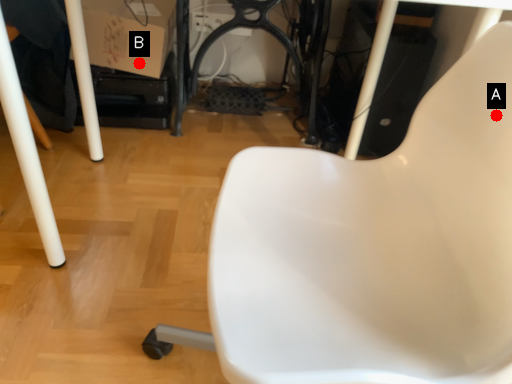
Question: Two points are circled on the image, labeled by A and B beside each circle. Which of the following is the farthest from the observer?

Choices:
 (A) A is further
 (B) B is further

Answer: (B)